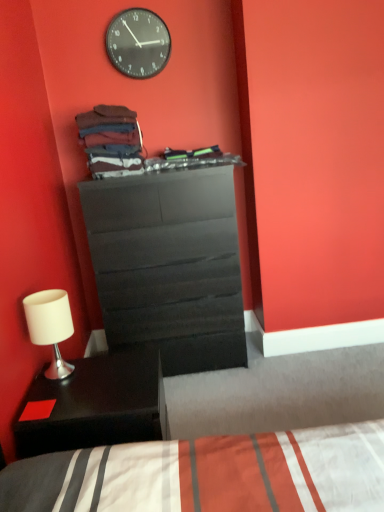
At what (x,y) coordinates should I click in order to perform the action: click on black matte nightstand at lower left. Please return your answer as a coordinate pair (x, y). The image size is (384, 512). Looking at the image, I should click on (97, 404).

Between black matte nightstand at lower left and black glass clock at upper center, which one has larger size?

Bigger between the two is black matte nightstand at lower left.

From a real-world perspective, is black matte nightstand at lower left beneath black glass clock at upper center?

Correct, in the physical world, black matte nightstand at lower left is lower than black glass clock at upper center.

Which object is closer to the camera, black matte nightstand at lower left or black glass clock at upper center?

black matte nightstand at lower left.

Can we say black matte nightstand at lower left lies outside black glass clock at upper center?

That's correct, black matte nightstand at lower left is outside of black glass clock at upper center.

Is white matte table lamp at lower left not close to matte black dresser at center?

No, white matte table lamp at lower left is in close proximity to matte black dresser at center.

From a real-world perspective, is white matte table lamp at lower left over matte black dresser at center?

Yes, from a real-world perspective, white matte table lamp at lower left is above matte black dresser at center.

The height and width of the screenshot is (512, 384). I want to click on the chest of drawers beneath the white matte table lamp at lower left (from a real-world perspective), so click(x=169, y=266).

Could you tell me if white matte table lamp at lower left is turned towards matte black dresser at center?

No, white matte table lamp at lower left is not turned towards matte black dresser at center.

From the image's perspective, between matte black dresser at center and black glass clock at upper center, who is located below?

matte black dresser at center.

Based on the photo, from a real-world perspective, between matte black dresser at center and black glass clock at upper center, who is vertically higher?

black glass clock at upper center is physically above.

This screenshot has width=384, height=512. I want to click on the chest of drawers lying in front of the black glass clock at upper center, so click(169, 266).

Which of these two, matte black dresser at center or black glass clock at upper center, is wider?

With larger width is matte black dresser at center.

In the scene shown: From a real-world perspective, is matte black dresser at center under black matte nightstand at lower left?

No, from a real-world perspective, matte black dresser at center is not below black matte nightstand at lower left.

Considering the relative sizes of matte black dresser at center and black matte nightstand at lower left in the image provided, is matte black dresser at center shorter than black matte nightstand at lower left?

Result: Incorrect, the height of matte black dresser at center does not fall short of that of black matte nightstand at lower left.

From the image's perspective, is matte black dresser at center beneath black matte nightstand at lower left?

No, from the image's perspective, matte black dresser at center is not beneath black matte nightstand at lower left.

Could you tell me if matte black dresser at center is turned towards black matte nightstand at lower left?

Yes, matte black dresser at center is aimed at black matte nightstand at lower left.

Would you say black matte nightstand at lower left is inside or outside white matte table lamp at lower left?

The correct answer is: outside.

Considering the relative positions of black matte nightstand at lower left and white matte table lamp at lower left in the image provided, is black matte nightstand at lower left in front of white matte table lamp at lower left?

Yes, it is in front of white matte table lamp at lower left.

From the image's perspective, between black matte nightstand at lower left and white matte table lamp at lower left, who is located below?

black matte nightstand at lower left, from the image's perspective.

Which of these two, black matte nightstand at lower left or white matte table lamp at lower left, is thinner?

white matte table lamp at lower left.

Considering the relative positions of black glass clock at upper center and white matte table lamp at lower left in the image provided, is black glass clock at upper center behind white matte table lamp at lower left?

Yes, the depth of black glass clock at upper center is greater than that of white matte table lamp at lower left.

Can you confirm if black glass clock at upper center is bigger than white matte table lamp at lower left?

No.

Is black glass clock at upper center aimed at white matte table lamp at lower left?

No.

In terms of height, does black glass clock at upper center look taller or shorter compared to white matte table lamp at lower left?

Considering their sizes, black glass clock at upper center has more height than white matte table lamp at lower left.

Which object is positioned more to the left, white matte table lamp at lower left or black glass clock at upper center?

From the viewer's perspective, white matte table lamp at lower left appears more on the left side.

Looking at this image, would you say white matte table lamp at lower left is a long distance from black glass clock at upper center?

Yes, white matte table lamp at lower left is far from black glass clock at upper center.

Is white matte table lamp at lower left looking in the opposite direction of black glass clock at upper center?

No, white matte table lamp at lower left's orientation is not away from black glass clock at upper center.

This screenshot has height=512, width=384. Find the location of `nightstand that appears below the black glass clock at upper center (from the image's perspective)`. nightstand that appears below the black glass clock at upper center (from the image's perspective) is located at coordinates (97, 404).

In order to click on table lamp that appears on the left of matte black dresser at center in this screenshot , I will do `click(50, 326)`.

Based on their spatial positions, is white matte table lamp at lower left or black glass clock at upper center closer to matte black dresser at center?

white matte table lamp at lower left.

Estimate the real-world distances between objects in this image. Which object is closer to matte black dresser at center, black matte nightstand at lower left or white matte table lamp at lower left?

Among the two, white matte table lamp at lower left is located nearer to matte black dresser at center.

From the image, which object appears to be nearer to white matte table lamp at lower left, black matte nightstand at lower left or matte black dresser at center?

black matte nightstand at lower left lies closer to white matte table lamp at lower left than the other object.

Estimate the real-world distances between objects in this image. Which object is closer to black matte nightstand at lower left, matte black dresser at center or black glass clock at upper center?

Among the two, matte black dresser at center is located nearer to black matte nightstand at lower left.

Considering their positions, is white matte table lamp at lower left positioned closer to black matte nightstand at lower left than black glass clock at upper center?

white matte table lamp at lower left is positioned closer to the anchor black matte nightstand at lower left.

From the image, which object appears to be nearer to white matte table lamp at lower left, matte black dresser at center or black glass clock at upper center?

matte black dresser at center is positioned closer to the anchor white matte table lamp at lower left.

Based on their spatial positions, is white matte table lamp at lower left or matte black dresser at center closer to black matte nightstand at lower left?

Based on the image, white matte table lamp at lower left appears to be nearer to black matte nightstand at lower left.

Based on their spatial positions, is black glass clock at upper center or matte black dresser at center further from black matte nightstand at lower left?

black glass clock at upper center lies further to black matte nightstand at lower left than the other object.

The width and height of the screenshot is (384, 512). I want to click on table lamp that lies between black glass clock at upper center and black matte nightstand at lower left from top to bottom, so click(x=50, y=326).

Where is `chest of drawers between black glass clock at upper center and white matte table lamp at lower left from top to bottom`? chest of drawers between black glass clock at upper center and white matte table lamp at lower left from top to bottom is located at coordinates (169, 266).

Identify the location of the chest of drawers between black glass clock at upper center and black matte nightstand at lower left vertically. (169, 266).

This screenshot has height=512, width=384. What are the coordinates of `table lamp positioned between black matte nightstand at lower left and matte black dresser at center from near to far` in the screenshot? It's located at (50, 326).